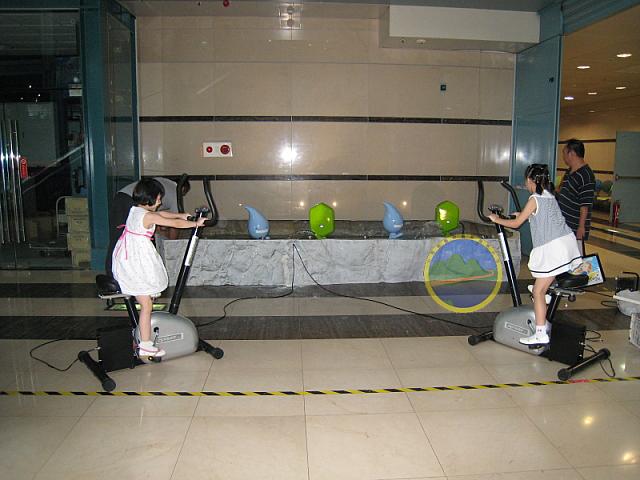
Where is `exercise bike`? This screenshot has width=640, height=480. exercise bike is located at coordinates (176, 326), (520, 323).